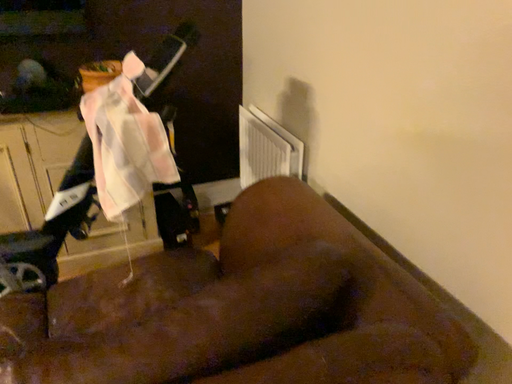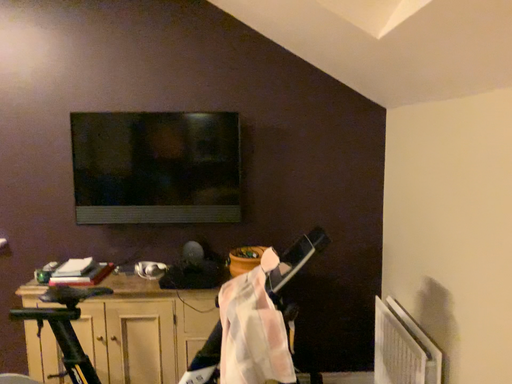
Question: How did the camera likely rotate when shooting the video?

Choices:
 (A) rotated downward
 (B) rotated upward

Answer: (B)